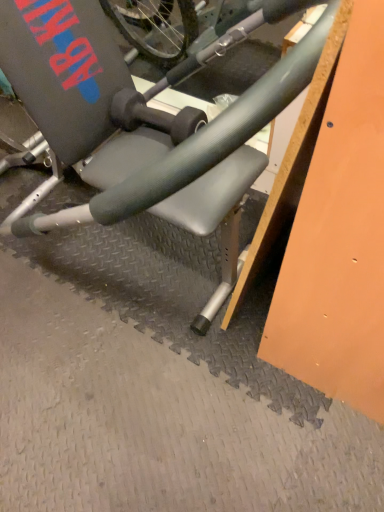
Describe the element at coordinates (133, 120) in the screenshot. The width and height of the screenshot is (384, 512). I see `matte gray bench at center` at that location.

This screenshot has height=512, width=384. In order to click on matte gray bench at center in this screenshot , I will do `click(133, 120)`.

Image resolution: width=384 pixels, height=512 pixels. What are the coordinates of `matte gray bench at center` in the screenshot? It's located at (133, 120).